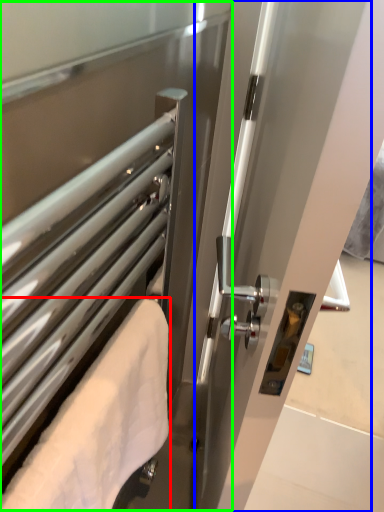
Question: Which is farther away from towel (highlighted by a red box)? screen door (highlighted by a blue box) or screen door (highlighted by a green box)?

Choices:
 (A) screen door
 (B) screen door

Answer: (A)